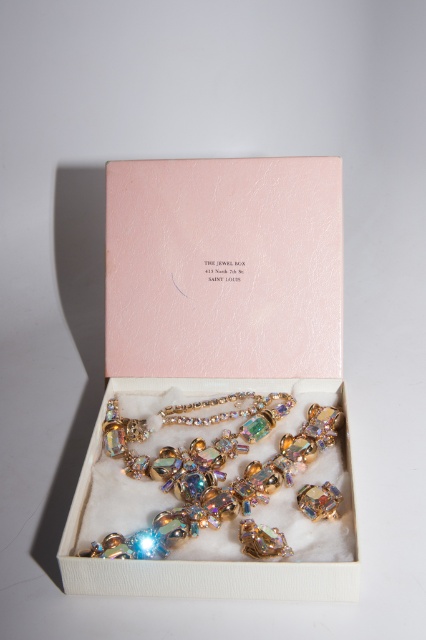
Question: Which of the following is the closest to the observer?

Choices:
 (A) (279, 413)
 (B) (259, 355)

Answer: (A)

Question: Is pink leather gift box at center above iridescent gold necklace at center?

Choices:
 (A) yes
 (B) no

Answer: (A)

Question: Can you confirm if pink leather gift box at center is positioned to the left of iridescent gold necklace at center?

Choices:
 (A) no
 (B) yes

Answer: (B)

Question: Can you confirm if pink leather gift box at center is thinner than iridescent gold necklace at center?

Choices:
 (A) yes
 (B) no

Answer: (B)

Question: Which object is farther from the camera taking this photo?

Choices:
 (A) iridescent gold necklace at center
 (B) pink leather gift box at center

Answer: (A)